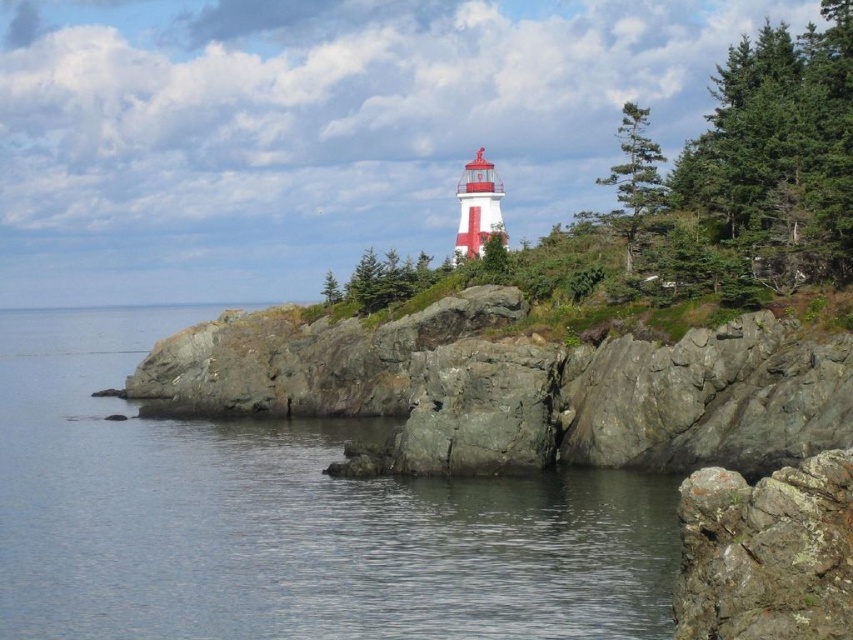
Question: In this image, where is green matte tree at upper right located relative to green matte tree at upper center?

Choices:
 (A) above
 (B) below

Answer: (A)

Question: Which point is farther to the camera?

Choices:
 (A) (384, 275)
 (B) (653, 173)

Answer: (A)

Question: Can you confirm if transparent water at lower left is positioned above green matte tree at upper right?

Choices:
 (A) no
 (B) yes

Answer: (A)

Question: Does green textured tree at upper right appear on the right side of green matte tree at upper center?

Choices:
 (A) yes
 (B) no

Answer: (A)

Question: Which of the following is the closest to the observer?

Choices:
 (A) green matte tree at upper center
 (B) green matte tree at upper right
 (C) rusty rock at lower right
 (D) transparent water at lower left

Answer: (C)

Question: Estimate the real-world distances between objects in this image. Which object is closer to the rusty rock at lower right?

Choices:
 (A) green matte tree at upper right
 (B) transparent water at lower left

Answer: (B)